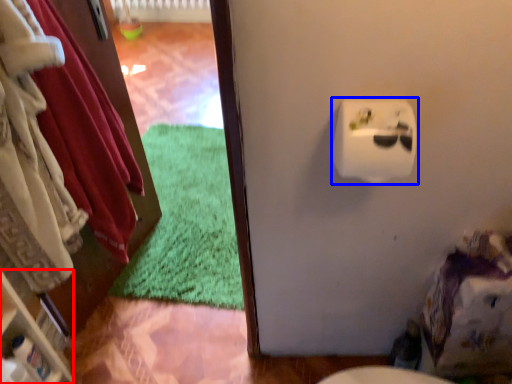
Question: Which object is further to the camera taking this photo, shelf (highlighted by a red box) or toilet paper (highlighted by a blue box)?

Choices:
 (A) shelf
 (B) toilet paper

Answer: (A)